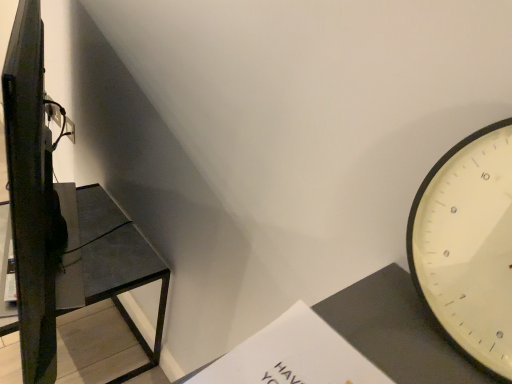
Question: From a real-world perspective, does matte black shelf at left sit lower than white paper at lower center?

Choices:
 (A) yes
 (B) no

Answer: (A)

Question: Is matte black shelf at left outside white paper at lower center?

Choices:
 (A) yes
 (B) no

Answer: (A)

Question: Is matte black shelf at left oriented away from white paper at lower center?

Choices:
 (A) yes
 (B) no

Answer: (B)

Question: From the image's perspective, is matte black shelf at left on top of white paper at lower center?

Choices:
 (A) yes
 (B) no

Answer: (B)

Question: Is matte black shelf at left to the right of white paper at lower center from the viewer's perspective?

Choices:
 (A) no
 (B) yes

Answer: (A)

Question: Can you confirm if matte black shelf at left is bigger than white paper at lower center?

Choices:
 (A) no
 (B) yes

Answer: (B)

Question: Are white paper at lower center and matte black shelf at left located far from each other?

Choices:
 (A) yes
 (B) no

Answer: (B)

Question: From the image's perspective, does white paper at lower center appear higher than matte black shelf at left?

Choices:
 (A) no
 (B) yes

Answer: (B)

Question: Considering the relative sizes of white paper at lower center and matte black shelf at left in the image provided, is white paper at lower center bigger than matte black shelf at left?

Choices:
 (A) no
 (B) yes

Answer: (A)

Question: Is white paper at lower center smaller than matte black shelf at left?

Choices:
 (A) yes
 (B) no

Answer: (A)

Question: Is matte black shelf at left at the back of white paper at lower center?

Choices:
 (A) yes
 (B) no

Answer: (B)

Question: Is the depth of white paper at lower center less than that of matte black shelf at left?

Choices:
 (A) yes
 (B) no

Answer: (A)

Question: Considering the positions of point [x=207, y=380] and point [x=98, y=264], is point [x=207, y=380] closer or farther from the camera than point [x=98, y=264]?

Choices:
 (A) closer
 (B) farther

Answer: (A)